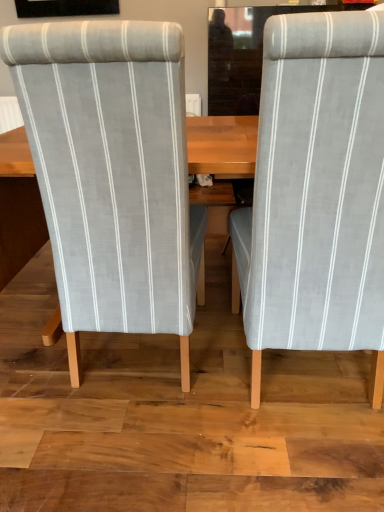
Locate an element on the screen. The height and width of the screenshot is (512, 384). light gray striped fabric chair at left, which appears as the first chair when viewed from the left is located at coordinates (112, 174).

What do you see at coordinates (112, 174) in the screenshot?
I see `light gray striped fabric chair at left, which appears as the first chair when viewed from the left` at bounding box center [112, 174].

This screenshot has width=384, height=512. Describe the element at coordinates (316, 193) in the screenshot. I see `gray fabric chair at right, which is the 1th chair in right-to-left order` at that location.

I want to click on gray fabric chair at right, which is the 1th chair in right-to-left order, so click(x=316, y=193).

What is the approximate width of gray fabric chair at right, which is the 1th chair in right-to-left order?

gray fabric chair at right, which is the 1th chair in right-to-left order, is 24.94 inches wide.

The width and height of the screenshot is (384, 512). Identify the location of light gray striped fabric chair at left, which appears as the first chair when viewed from the left. (112, 174).

In the image, is gray fabric chair at right, which is the 1th chair in right-to-left order, on the left side or the right side of light gray striped fabric chair at left, which appears as the first chair when viewed from the left?

Clearly, gray fabric chair at right, which is the 1th chair in right-to-left order, is on the right of light gray striped fabric chair at left, which appears as the first chair when viewed from the left, in the image.

Does gray fabric chair at right, the second chair positioned from the left, lie in front of light gray striped fabric chair at left, the second chair from the right?

Yes, it is in front of light gray striped fabric chair at left, the second chair from the right.

Between point (281, 92) and point (61, 127), which one is positioned in front?

The point (281, 92) is closer to the camera.

From the image's perspective, is gray fabric chair at right, the second chair positioned from the left, positioned above or below light gray striped fabric chair at left, the second chair from the right?

From the image's perspective, gray fabric chair at right, the second chair positioned from the left, appears below light gray striped fabric chair at left, the second chair from the right.

From a real-world perspective, is gray fabric chair at right, the second chair positioned from the left, below light gray striped fabric chair at left, which appears as the first chair when viewed from the left?

Actually, gray fabric chair at right, the second chair positioned from the left, is physically above light gray striped fabric chair at left, which appears as the first chair when viewed from the left, in the real world.

Looking at this image, between gray fabric chair at right, which is the 1th chair in right-to-left order, and light gray striped fabric chair at left, the second chair from the right, which one has larger width?

gray fabric chair at right, which is the 1th chair in right-to-left order, is wider.

Which of these two, gray fabric chair at right, which is the 1th chair in right-to-left order, or light gray striped fabric chair at left, the second chair from the right, stands shorter?

With less height is light gray striped fabric chair at left, the second chair from the right.

Based on the photo, is gray fabric chair at right, the second chair positioned from the left, bigger than light gray striped fabric chair at left, the second chair from the right?

No, gray fabric chair at right, the second chair positioned from the left, is not bigger than light gray striped fabric chair at left, the second chair from the right.

Would you say gray fabric chair at right, the second chair positioned from the left, is outside light gray striped fabric chair at left, which appears as the first chair when viewed from the left?

gray fabric chair at right, the second chair positioned from the left, lies outside light gray striped fabric chair at left, which appears as the first chair when viewed from the left,'s area.

Consider the image. Are gray fabric chair at right, the second chair positioned from the left, and light gray striped fabric chair at left, the second chair from the right, beside each other?

gray fabric chair at right, the second chair positioned from the left, and light gray striped fabric chair at left, the second chair from the right, are not in contact.

Is gray fabric chair at right, the second chair positioned from the left, aimed at light gray striped fabric chair at left, the second chair from the right?

No, gray fabric chair at right, the second chair positioned from the left, is not oriented towards light gray striped fabric chair at left, the second chair from the right.

How different are the orientations of gray fabric chair at right, which is the 1th chair in right-to-left order, and light gray striped fabric chair at left, which appears as the first chair when viewed from the left, in degrees?

They differ by 1.83e-05 degrees in their facing directions.

Image resolution: width=384 pixels, height=512 pixels. I want to click on chair on the left of gray fabric chair at right, which is the 1th chair in right-to-left order, so click(112, 174).

Between light gray striped fabric chair at left, which appears as the first chair when viewed from the left, and gray fabric chair at right, the second chair positioned from the left, which one appears on the left side from the viewer's perspective?

light gray striped fabric chair at left, which appears as the first chair when viewed from the left.

Considering the positions of objects light gray striped fabric chair at left, the second chair from the right, and gray fabric chair at right, the second chair positioned from the left, in the image provided, who is behind, light gray striped fabric chair at left, the second chair from the right, or gray fabric chair at right, the second chair positioned from the left,?

light gray striped fabric chair at left, the second chair from the right, is more distant.

Is point (82, 274) in front of point (370, 228)?

No, (82, 274) is behind (370, 228).

From the image's perspective, which object appears higher, light gray striped fabric chair at left, the second chair from the right, or gray fabric chair at right, which is the 1th chair in right-to-left order?

light gray striped fabric chair at left, the second chair from the right, is shown above in the image.

From a real-world perspective, between light gray striped fabric chair at left, the second chair from the right, and gray fabric chair at right, which is the 1th chair in right-to-left order, who is vertically lower?

light gray striped fabric chair at left, the second chair from the right.

Which object is wider, light gray striped fabric chair at left, the second chair from the right, or gray fabric chair at right, the second chair positioned from the left?

gray fabric chair at right, the second chair positioned from the left.

Considering the relative sizes of light gray striped fabric chair at left, which appears as the first chair when viewed from the left, and gray fabric chair at right, which is the 1th chair in right-to-left order, in the image provided, is light gray striped fabric chair at left, which appears as the first chair when viewed from the left, taller than gray fabric chair at right, which is the 1th chair in right-to-left order,?

Incorrect, the height of light gray striped fabric chair at left, which appears as the first chair when viewed from the left, is not larger of that of gray fabric chair at right, which is the 1th chair in right-to-left order.

Who is smaller, light gray striped fabric chair at left, which appears as the first chair when viewed from the left, or gray fabric chair at right, which is the 1th chair in right-to-left order?

Smaller between the two is gray fabric chair at right, which is the 1th chair in right-to-left order.

Is light gray striped fabric chair at left, which appears as the first chair when viewed from the left, spatially inside gray fabric chair at right, the second chair positioned from the left, or outside of it?

light gray striped fabric chair at left, which appears as the first chair when viewed from the left, cannot be found inside gray fabric chair at right, the second chair positioned from the left.

Does light gray striped fabric chair at left, the second chair from the right, turn towards gray fabric chair at right, which is the 1th chair in right-to-left order?

No, light gray striped fabric chair at left, the second chair from the right, does not turn towards gray fabric chair at right, which is the 1th chair in right-to-left order.

In order to click on chair above the light gray striped fabric chair at left, which appears as the first chair when viewed from the left (from a real-world perspective) in this screenshot , I will do `click(316, 193)`.

The width and height of the screenshot is (384, 512). I want to click on chair above the light gray striped fabric chair at left, the second chair from the right (from a real-world perspective), so click(316, 193).

Locate an element on the screen. chair in front of the light gray striped fabric chair at left, which appears as the first chair when viewed from the left is located at coordinates (316, 193).